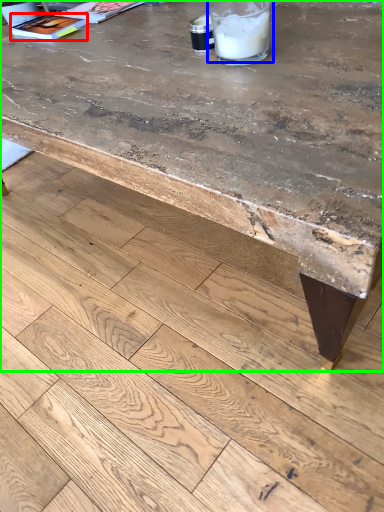
Question: Which object is positioned closest to magazine (highlighted by a red box)? Select from drinking straw (highlighted by a blue box) and table (highlighted by a green box).

Choices:
 (A) drinking straw
 (B) table

Answer: (A)